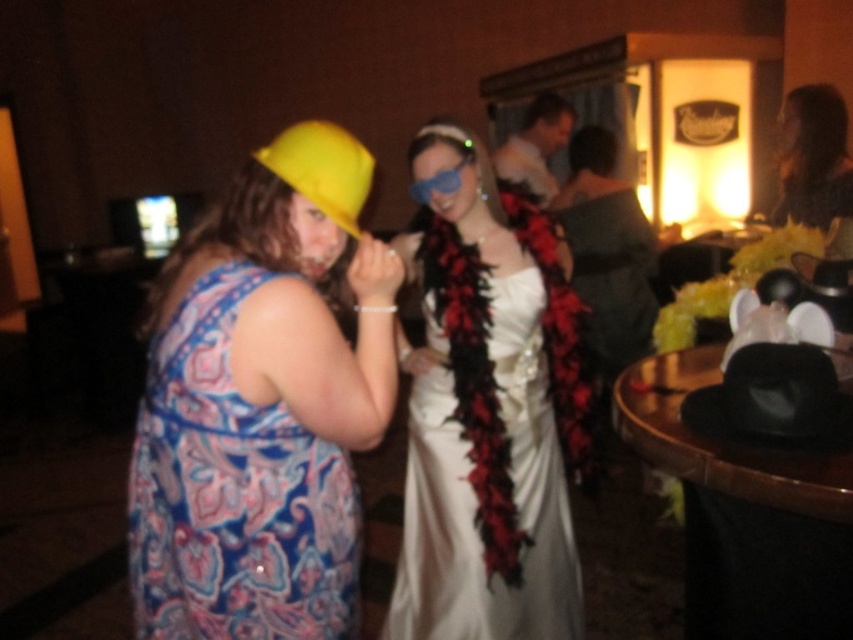
Who is positioned more to the left, matte gray shirt at upper center or blue matte goggles at center?

Positioned to the left is blue matte goggles at center.

Is matte gray shirt at upper center further to the viewer compared to blue matte goggles at center?

Yes, matte gray shirt at upper center is behind blue matte goggles at center.

Does point (550, 131) come behind point (445, 188)?

Yes, point (550, 131) is behind point (445, 188).

Find the location of `matte gray shirt at upper center`. matte gray shirt at upper center is located at coordinates (535, 145).

Who is lower down, matte yellow hat at left or yellow fabric hat at upper left?

matte yellow hat at left is below.

Who is more distant from viewer, [265,628] or [338,157]?

The point [338,157] is behind.

Where is `matte yellow hat at left`? matte yellow hat at left is located at coordinates (262, 403).

What do you see at coordinates (262, 403) in the screenshot? Image resolution: width=853 pixels, height=640 pixels. I see `matte yellow hat at left` at bounding box center [262, 403].

Does matte yellow hat at left have a lesser height compared to blue matte goggles at center?

No, matte yellow hat at left is not shorter than blue matte goggles at center.

Where is `matte yellow hat at left`? matte yellow hat at left is located at coordinates (262, 403).

Identify the location of matte yellow hat at left. (262, 403).